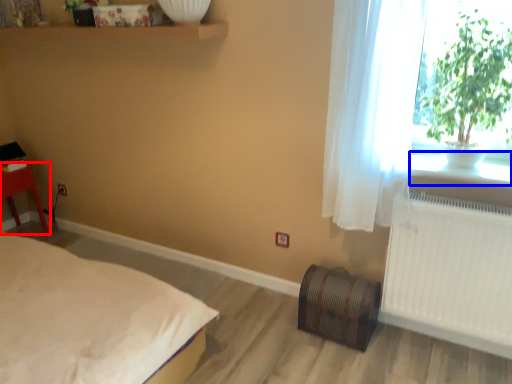
Question: Among these objects, which one is farthest to the camera, furniture (highlighted by a red box) or window sill (highlighted by a blue box)?

Choices:
 (A) furniture
 (B) window sill

Answer: (A)